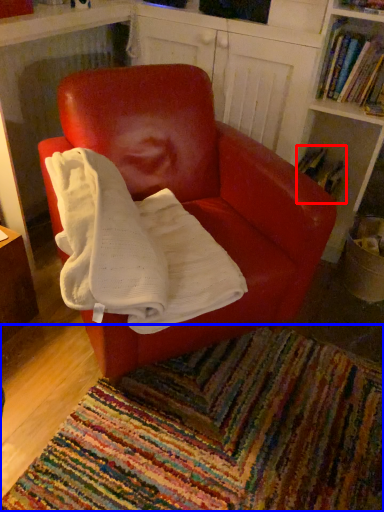
Question: Which of the following is the farthest to the observer, book (highlighted by a red box) or mat (highlighted by a blue box)?

Choices:
 (A) book
 (B) mat

Answer: (A)